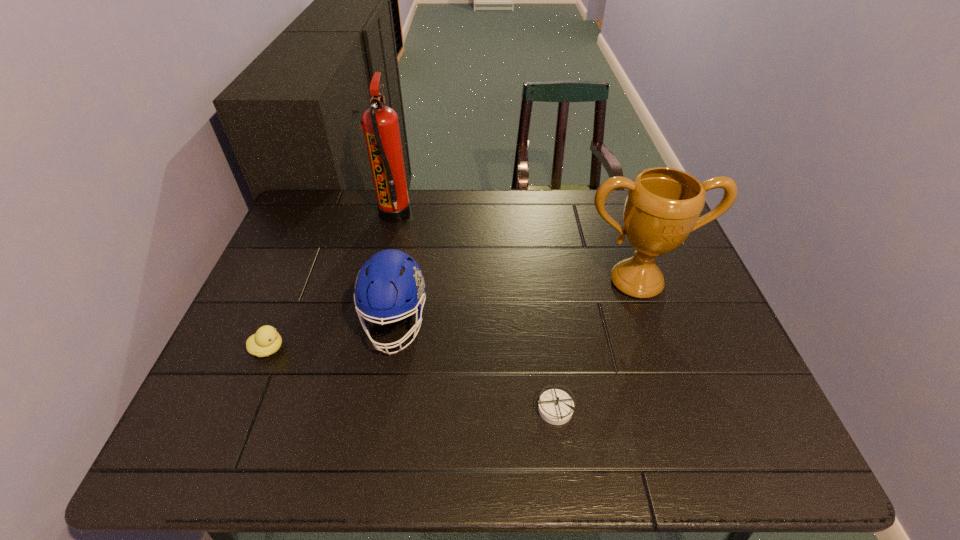
Find the location of a particular element. The width and height of the screenshot is (960, 540). vacant space at the left edge is located at coordinates (222, 383).

Identify the location of free space at the right edge of the desktop. (681, 255).

In the image, there is a desktop. Where is `vacant space at the far left corner`? vacant space at the far left corner is located at coordinates (333, 210).

Where is `free space at the near left corner`? The width and height of the screenshot is (960, 540). free space at the near left corner is located at coordinates (241, 460).

In the image, there is a desktop. At what (x,y) coordinates should I click in order to perform the action: click on vacant region at the near right corner. Please return your answer as a coordinate pair (x, y). Image resolution: width=960 pixels, height=540 pixels. Looking at the image, I should click on (728, 455).

I want to click on vacant region between the fourth tallest object and the tallest object, so click(x=331, y=281).

Locate an element on the screen. Image resolution: width=960 pixels, height=540 pixels. vacant region between the second object from right to left and the third tallest object is located at coordinates (475, 366).

This screenshot has width=960, height=540. I want to click on vacant space that is in between the football helmet and the compass, so click(475, 366).

Where is `free point between the farthest object and the leftmost object`? The width and height of the screenshot is (960, 540). free point between the farthest object and the leftmost object is located at coordinates (331, 281).

Locate an element on the screen. Image resolution: width=960 pixels, height=540 pixels. vacant space in between the shortest object and the second shortest object is located at coordinates (411, 379).